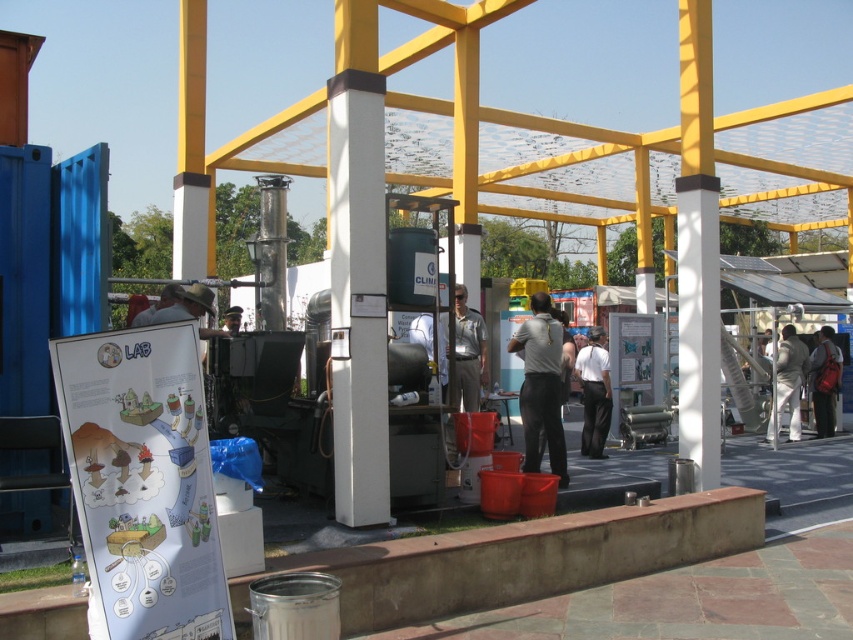
You are a photographer trying to capture a photo of the dark gray uniform at center and the brown leather hat at center. If you want to ensure both are fully visible in the frame, which object should you position closer to the camera to avoid cropping?

You should position the dark gray uniform at center closer to the camera because it might be wider than the brown leather hat at center, ensuring both fit within the frame without cropping.

You are a photographer trying to capture both the dark gray uniform at center and the white smooth shirt at center in a single frame. Since you want to highlight the height difference between them, which one should you position closer to the camera to emphasize their size difference?

To emphasize the height difference between the dark gray uniform at center and the white smooth shirt at center, position the dark gray uniform at center closer to the camera since it is taller than the white smooth shirt at center.

You are a photographer at the event and want to capture both the white smooth shirt at center and the brown fabric hat at center in a single frame. Considering their sizes, which object should you focus on to ensure both are clearly visible?

The white smooth shirt at center is larger than the brown fabric hat at center, so focusing on the white smooth shirt at center would ensure both are clearly visible in the frame.